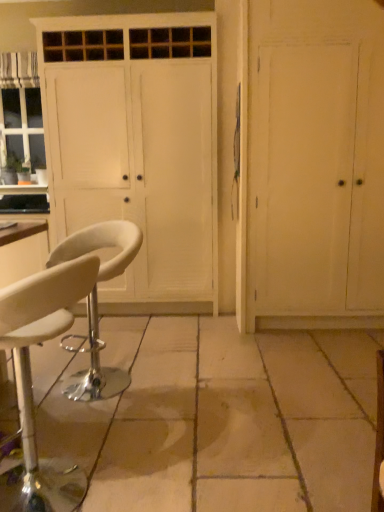
Question: Is white wood cabinet at center positioned behind white leather stool at lower left, the first chair when ordered from back to front?

Choices:
 (A) no
 (B) yes

Answer: (B)

Question: Can you confirm if white wood cabinet at center is wider than white leather stool at lower left, the first chair when ordered from back to front?

Choices:
 (A) no
 (B) yes

Answer: (B)

Question: From a real-world perspective, is white wood cabinet at center physically above white leather stool at lower left, the first chair when ordered from back to front?

Choices:
 (A) yes
 (B) no

Answer: (A)

Question: Is white wood cabinet at center to the right of white leather stool at lower left, the first chair when ordered from back to front, from the viewer's perspective?

Choices:
 (A) yes
 (B) no

Answer: (A)

Question: From the image's perspective, is white wood cabinet at center above white leather stool at lower left, the second chair from the front?

Choices:
 (A) no
 (B) yes

Answer: (B)

Question: From the image's perspective, is white leather stool at lower left, the second chair from the front, above or below white leather stool at lower left, the second chair from the back?

Choices:
 (A) above
 (B) below

Answer: (A)

Question: Relative to white leather stool at lower left, the second chair from the back, is white leather stool at lower left, the second chair from the front, in front or behind?

Choices:
 (A) behind
 (B) front

Answer: (A)

Question: Would you say white leather stool at lower left, the second chair from the front, is inside or outside white leather stool at lower left, placed as the 1th chair when sorted from front to back?

Choices:
 (A) outside
 (B) inside

Answer: (A)

Question: Is white leather stool at lower left, the second chair from the front, taller or shorter than white leather stool at lower left, the second chair from the back?

Choices:
 (A) short
 (B) tall

Answer: (A)

Question: Considering the relative positions of white wood door at right and white leather stool at lower left, the second chair from the front, in the image provided, is white wood door at right to the left or to the right of white leather stool at lower left, the second chair from the front,?

Choices:
 (A) left
 (B) right

Answer: (B)

Question: Considering the positions of white wood door at right and white leather stool at lower left, the first chair when ordered from back to front, in the image, is white wood door at right wider or thinner than white leather stool at lower left, the first chair when ordered from back to front,?

Choices:
 (A) wide
 (B) thin

Answer: (A)

Question: From the image's perspective, is white wood door at right above or below white leather stool at lower left, the first chair when ordered from back to front?

Choices:
 (A) above
 (B) below

Answer: (A)

Question: Considering their positions, is white wood door at right located in front of or behind white leather stool at lower left, the second chair from the front?

Choices:
 (A) front
 (B) behind

Answer: (B)

Question: From a real-world perspective, is white wood cabinet at center physically located above or below white leather stool at lower left, the first chair when ordered from back to front?

Choices:
 (A) below
 (B) above

Answer: (B)

Question: Is white wood cabinet at center in front of or behind white leather stool at lower left, the first chair when ordered from back to front, in the image?

Choices:
 (A) front
 (B) behind

Answer: (B)